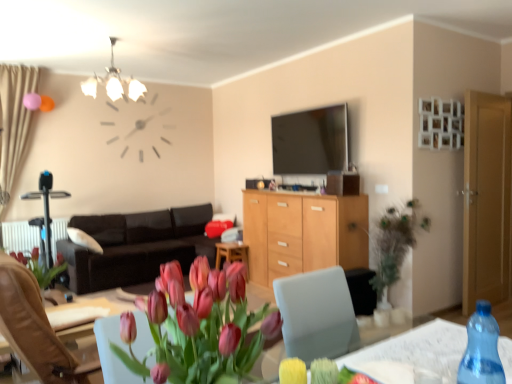
Question: Should I look upward or downward to see beige fabric curtain at left?

Choices:
 (A) up
 (B) down

Answer: (A)

Question: Can green leafy plant at right be found inside matte glass chandelier at upper center?

Choices:
 (A) yes
 (B) no

Answer: (B)

Question: Can you confirm if matte glass chandelier at upper center is wider than green leafy plant at right?

Choices:
 (A) no
 (B) yes

Answer: (B)

Question: From a real-world perspective, does matte glass chandelier at upper center stand above green leafy plant at right?

Choices:
 (A) yes
 (B) no

Answer: (A)

Question: Is matte glass chandelier at upper center smaller than green leafy plant at right?

Choices:
 (A) yes
 (B) no

Answer: (B)

Question: Does matte glass chandelier at upper center turn towards green leafy plant at right?

Choices:
 (A) no
 (B) yes

Answer: (A)

Question: Can you confirm if matte glass chandelier at upper center is bigger than green leafy plant at right?

Choices:
 (A) yes
 (B) no

Answer: (A)

Question: Is beige fabric curtain at left next to wooden desk at center?

Choices:
 (A) no
 (B) yes

Answer: (A)

Question: From a real-world perspective, is beige fabric curtain at left located beneath wooden desk at center?

Choices:
 (A) no
 (B) yes

Answer: (A)

Question: Is beige fabric curtain at left completely or partially outside of wooden desk at center?

Choices:
 (A) no
 (B) yes

Answer: (B)

Question: From the image's perspective, is beige fabric curtain at left below wooden desk at center?

Choices:
 (A) yes
 (B) no

Answer: (B)

Question: Can you confirm if beige fabric curtain at left is wider than wooden desk at center?

Choices:
 (A) no
 (B) yes

Answer: (A)

Question: Is beige fabric curtain at left oriented away from wooden desk at center?

Choices:
 (A) no
 (B) yes

Answer: (A)

Question: Is beige fabric curtain at left turned away from green leafy plant at right?

Choices:
 (A) no
 (B) yes

Answer: (A)